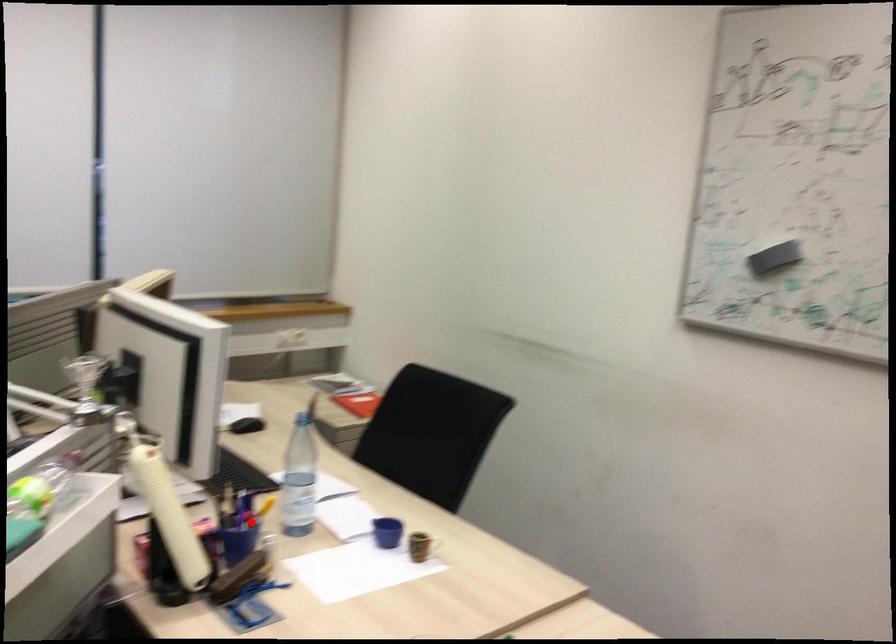
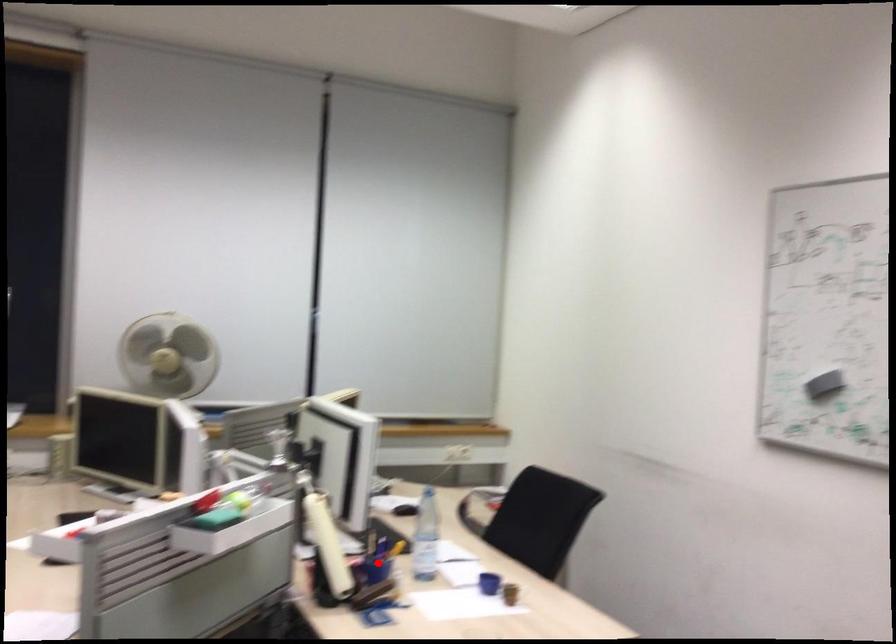
I am providing you with two images of the same scene from different viewpoints. A red point is marked on the first image and another point is marked on the second image. Does the point marked in image1 correspond to the same location as the one in image2?

Yes